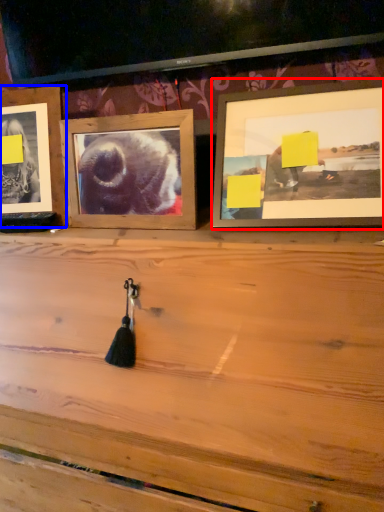
Question: Among these objects, which one is farthest to the camera, picture frame (highlighted by a red box) or picture frame (highlighted by a blue box)?

Choices:
 (A) picture frame
 (B) picture frame

Answer: (B)